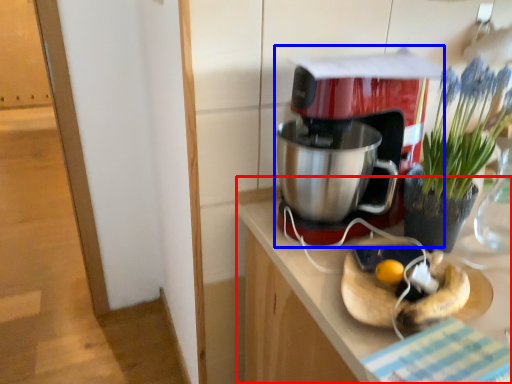
Question: Which point is closer to the camera, counter (highlighted by a red box) or coffee maker (highlighted by a blue box)?

Choices:
 (A) counter
 (B) coffee maker

Answer: (A)